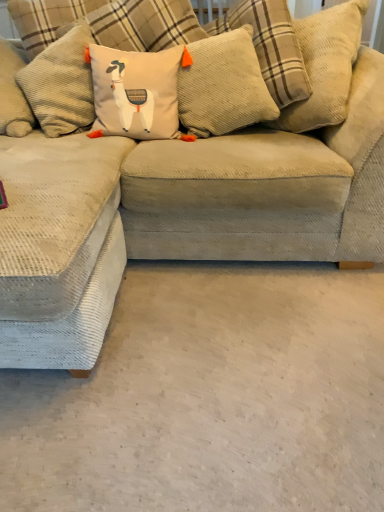
What do you see at coordinates (309, 72) in the screenshot? The image size is (384, 512). I see `corduroy pillow at center, arranged as the third pillow when viewed from the left` at bounding box center [309, 72].

Measure the distance between point (227, 120) and camera.

Point (227, 120) and camera are 1.69 meters apart.

Find the location of a particular element. This screenshot has width=384, height=512. corduroy pillow at center, arranged as the third pillow when viewed from the left is located at coordinates (309, 72).

Which point is more distant from viewer, (335,95) or (232,87)?

The point (232,87) is more distant.

In the scene shown: Can you tell me how much corduroy pillow at center, positioned as the 1th pillow in right-to-left order, and corduroy pillow at center, the 2th pillow from the right, differ in facing direction?

They differ by 39.7 degrees in their facing directions.

Is corduroy pillow at center, arranged as the third pillow when viewed from the left, closer to camera compared to corduroy pillow at center, the 2th pillow from the right?

That is True.

Is beige corduroy pillow with llama design at center, the first pillow when ordered from left to right, surrounding beige corduroy couch at center?

No, beige corduroy couch at center is not surrounded by beige corduroy pillow with llama design at center, the first pillow when ordered from left to right.

Is the surface of beige corduroy pillow with llama design at center, the first pillow when ordered from left to right, in direct contact with beige corduroy couch at center?

No, beige corduroy pillow with llama design at center, the first pillow when ordered from left to right, is not with beige corduroy couch at center.

Based on the photo, looking at their sizes, would you say beige corduroy pillow with llama design at center, placed as the third pillow when sorted from right to left, is wider or thinner than beige corduroy couch at center?

beige corduroy pillow with llama design at center, placed as the third pillow when sorted from right to left, is thinner than beige corduroy couch at center.

From the beige corduroy couch at center, count 2nd pillow to the right and point to it. Please provide its 2D coordinates.

[(309, 72)]

From the image's perspective, is beige corduroy couch at center positioned above or below corduroy pillow at center, positioned as the 1th pillow in right-to-left order?

beige corduroy couch at center is situated lower than corduroy pillow at center, positioned as the 1th pillow in right-to-left order, in the image.

Considering the relative sizes of beige corduroy couch at center and corduroy pillow at center, positioned as the 1th pillow in right-to-left order, in the image provided, is beige corduroy couch at center shorter than corduroy pillow at center, positioned as the 1th pillow in right-to-left order,?

No.

From a real-world perspective, who is located lower, beige corduroy couch at center or corduroy pillow at center, arranged as the third pillow when viewed from the left?

beige corduroy couch at center.

Is corduroy pillow at center, the 2th pillow from the right, placed right next to beige corduroy pillow with llama design at center, placed as the third pillow when sorted from right to left?

corduroy pillow at center, the 2th pillow from the right, and beige corduroy pillow with llama design at center, placed as the third pillow when sorted from right to left, are not in contact.

From a real-world perspective, is corduroy pillow at center, the 2th pillow from the right, positioned above or below beige corduroy pillow with llama design at center, the first pillow when ordered from left to right?

corduroy pillow at center, the 2th pillow from the right, is situated higher than beige corduroy pillow with llama design at center, the first pillow when ordered from left to right, in the real world.

Which is farther, (180, 121) or (191, 62)?

The point (180, 121) is behind.

Looking at this image, is beige corduroy pillow with llama design at center, placed as the third pillow when sorted from right to left, wider or thinner than white carpet at lower left?

beige corduroy pillow with llama design at center, placed as the third pillow when sorted from right to left, is thinner than white carpet at lower left.

Considering the positions of objects beige corduroy pillow with llama design at center, placed as the third pillow when sorted from right to left, and white carpet at lower left in the image provided, who is behind, beige corduroy pillow with llama design at center, placed as the third pillow when sorted from right to left, or white carpet at lower left?

beige corduroy pillow with llama design at center, placed as the third pillow when sorted from right to left.

Looking at this image, what's the angular difference between beige corduroy pillow with llama design at center, the first pillow when ordered from left to right, and white carpet at lower left's facing directions?

The facing directions of beige corduroy pillow with llama design at center, the first pillow when ordered from left to right, and white carpet at lower left are 4.9 degrees apart.

Would you say beige corduroy pillow with llama design at center, the first pillow when ordered from left to right, is to the left or to the right of white carpet at lower left in the picture?

From the image, it's evident that beige corduroy pillow with llama design at center, the first pillow when ordered from left to right, is to the left of white carpet at lower left.

Is beige corduroy couch at center bigger than corduroy pillow at center, placed as the second pillow when sorted from left to right?

Yes.

Consider the image. Which of these two, beige corduroy couch at center or corduroy pillow at center, the 2th pillow from the right, stands shorter?

corduroy pillow at center, the 2th pillow from the right.

Is beige corduroy couch at center positioned beyond the bounds of corduroy pillow at center, the 2th pillow from the right?

That's correct, beige corduroy couch at center is outside of corduroy pillow at center, the 2th pillow from the right.

Is corduroy pillow at center, arranged as the third pillow when viewed from the left, facing towards white carpet at lower left?

Yes.

In the scene shown: Considering the relative sizes of corduroy pillow at center, positioned as the 1th pillow in right-to-left order, and white carpet at lower left in the image provided, is corduroy pillow at center, positioned as the 1th pillow in right-to-left order, thinner than white carpet at lower left?

Indeed, corduroy pillow at center, positioned as the 1th pillow in right-to-left order, has a lesser width compared to white carpet at lower left.

You are a GUI agent. You are given a task and a screenshot of the screen. Output one action in this format:
    pyautogui.click(x=<x>, y=<y>)
    Task: Click on the 1st pillow positioned above the white carpet at lower left (from a real-world perspective)
    This screenshot has width=384, height=512.
    Given the screenshot: What is the action you would take?
    pyautogui.click(x=309, y=72)

Is corduroy pillow at center, arranged as the third pillow when viewed from the left, situated inside white carpet at lower left or outside?

corduroy pillow at center, arranged as the third pillow when viewed from the left, cannot be found inside white carpet at lower left.

Starting from the corduroy pillow at center, the 2th pillow from the right, which pillow is the 2nd one in front? Please provide its 2D coordinates.

[(309, 72)]

From the image's perspective, which pillow is the 1st one above the beige corduroy couch at center? Please provide its 2D coordinates.

[(136, 92)]

Consider the image. Which object lies further to the anchor point beige corduroy couch at center, corduroy pillow at center, placed as the second pillow when sorted from left to right, or white carpet at lower left?

Based on the image, white carpet at lower left appears to be further to beige corduroy couch at center.

Looking at the image, which one is located further to corduroy pillow at center, the 2th pillow from the right, white carpet at lower left or corduroy pillow at center, positioned as the 1th pillow in right-to-left order?

The object further to corduroy pillow at center, the 2th pillow from the right, is white carpet at lower left.

When comparing their distances from white carpet at lower left, does beige corduroy pillow with llama design at center, the first pillow when ordered from left to right, or beige corduroy couch at center seem closer?

beige corduroy couch at center.

Based on their spatial positions, is corduroy pillow at center, the 2th pillow from the right, or white carpet at lower left closer to corduroy pillow at center, arranged as the third pillow when viewed from the left?

corduroy pillow at center, the 2th pillow from the right.

From the image, which object appears to be farther from white carpet at lower left, beige corduroy couch at center or corduroy pillow at center, the 2th pillow from the right?

Among the two, corduroy pillow at center, the 2th pillow from the right, is located further to white carpet at lower left.

Looking at the image, which one is located closer to corduroy pillow at center, arranged as the third pillow when viewed from the left, white carpet at lower left or beige corduroy pillow with llama design at center, the first pillow when ordered from left to right?

beige corduroy pillow with llama design at center, the first pillow when ordered from left to right, is positioned closer to the anchor corduroy pillow at center, arranged as the third pillow when viewed from the left.

When comparing their distances from corduroy pillow at center, positioned as the 1th pillow in right-to-left order, does beige corduroy couch at center or beige corduroy pillow with llama design at center, placed as the third pillow when sorted from right to left, seem closer?

beige corduroy pillow with llama design at center, placed as the third pillow when sorted from right to left, lies closer to corduroy pillow at center, positioned as the 1th pillow in right-to-left order, than the other object.

Considering their positions, is beige corduroy pillow with llama design at center, placed as the third pillow when sorted from right to left, positioned further to corduroy pillow at center, the 2th pillow from the right, than corduroy pillow at center, arranged as the third pillow when viewed from the left?

corduroy pillow at center, arranged as the third pillow when viewed from the left, is positioned further to the anchor corduroy pillow at center, the 2th pillow from the right.

Where is `studio couch between corduroy pillow at center, the 2th pillow from the right, and white carpet at lower left vertically`? This screenshot has height=512, width=384. studio couch between corduroy pillow at center, the 2th pillow from the right, and white carpet at lower left vertically is located at coordinates (203, 215).

Identify the location of studio couch between corduroy pillow at center, positioned as the 1th pillow in right-to-left order, and white carpet at lower left, in the vertical direction. (203, 215).

I want to click on pillow between corduroy pillow at center, the 2th pillow from the right, and white carpet at lower left, in the vertical direction, so click(136, 92).

You are a GUI agent. You are given a task and a screenshot of the screen. Output one action in this format:
    pyautogui.click(x=<x>, y=<y>)
    Task: Click on the pillow located between beige corduroy couch at center and beige corduroy pillow with llama design at center, placed as the third pillow when sorted from right to left, in the depth direction
    This screenshot has width=384, height=512.
    Given the screenshot: What is the action you would take?
    pyautogui.click(x=309, y=72)